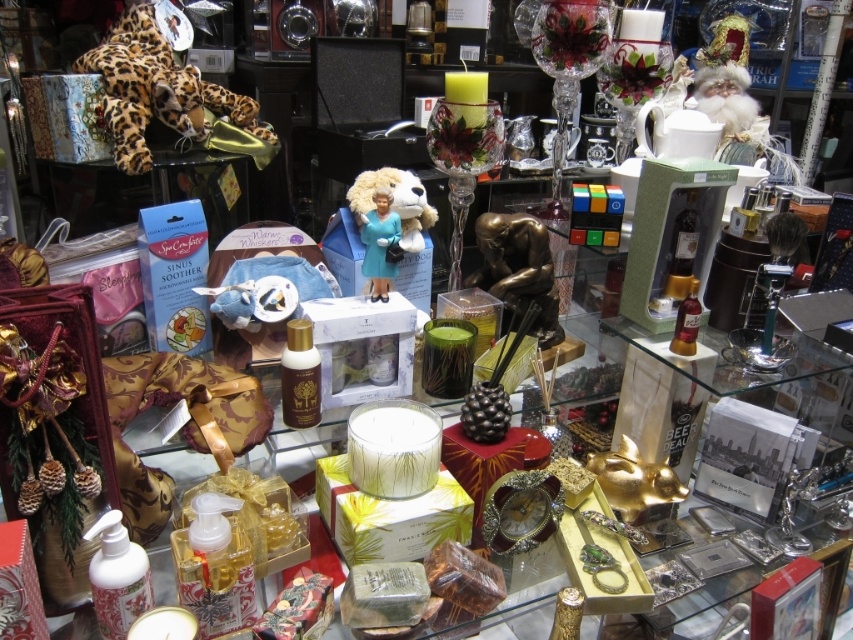
Does leopard print plush at upper left have a greater height compared to blue glossy figurine at center?

Indeed, leopard print plush at upper left has a greater height compared to blue glossy figurine at center.

Who is positioned more to the right, leopard print plush at upper left or blue glossy figurine at center?

Positioned to the right is blue glossy figurine at center.

Where is `leopard print plush at upper left`? leopard print plush at upper left is located at coordinates (155, 90).